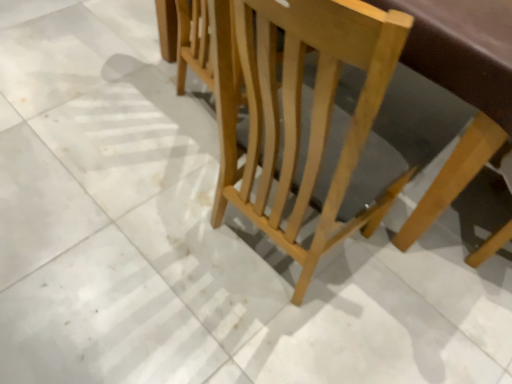
You are a GUI agent. You are given a task and a screenshot of the screen. Output one action in this format:
    pyautogui.click(x=<x>, y=<y>)
    Task: Click on the light wood chair at center
    Image resolution: width=512 pixels, height=384 pixels.
    Given the screenshot: What is the action you would take?
    pyautogui.click(x=312, y=112)

What do you see at coordinates (312, 112) in the screenshot?
I see `light wood chair at center` at bounding box center [312, 112].

Find the location of a particular element. The image size is (512, 384). light wood chair at center is located at coordinates (312, 112).